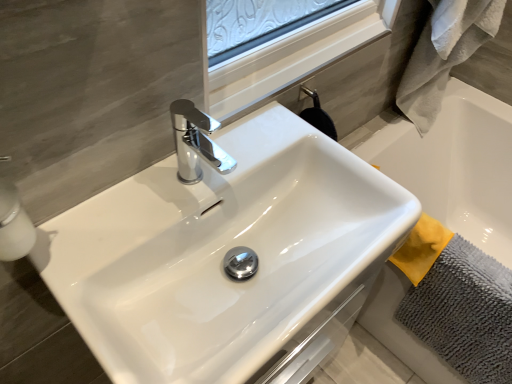
Question: In terms of width, does gray microfiber bath towel at lower right, the 1th bath towel when ordered from bottom to top, look wider or thinner when compared to gray fluffy bath towel at right, which is the 2th bath towel from bottom to top?

Choices:
 (A) thin
 (B) wide

Answer: (A)

Question: From the image's perspective, relative to gray fluffy bath towel at right, acting as the first bath towel starting from the top, is gray microfiber bath towel at lower right, the 1th bath towel when ordered from bottom to top, above or below?

Choices:
 (A) below
 (B) above

Answer: (A)

Question: Based on their relative distances, which object is nearer to the white glossy sink at center?

Choices:
 (A) gray microfiber bath towel at lower right, the 1th bath towel when ordered from bottom to top
 (B) gray fluffy bath towel at right, which is the 2th bath towel from bottom to top
 (C) white glossy soap dispenser at left

Answer: (C)

Question: Estimate the real-world distances between objects in this image. Which object is farther from the gray fluffy bath towel at right, which is the 2th bath towel from bottom to top?

Choices:
 (A) white glossy soap dispenser at left
 (B) gray microfiber bath towel at lower right, the second bath towel in the top-to-bottom sequence
 (C) white glossy sink at center

Answer: (A)